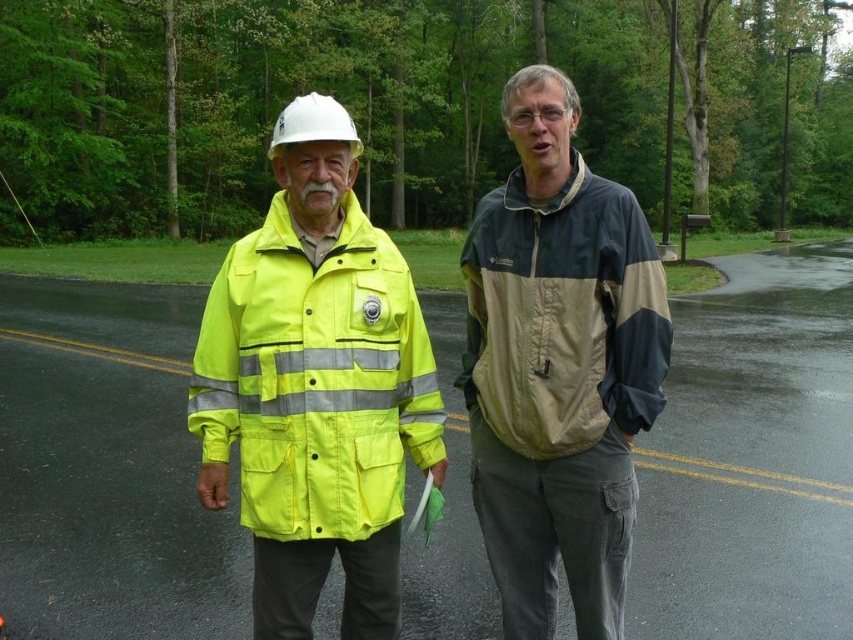
Question: Does high-visibility fabric jacket at left appear under white hard hat at center?

Choices:
 (A) yes
 (B) no

Answer: (A)

Question: Which of the following is the farthest from the observer?

Choices:
 (A) white hard hat at center
 (B) high-visibility yellow jacket at center
 (C) beige nylon jacket at center
 (D) high-visibility fabric jacket at left

Answer: (C)

Question: Which point is closer to the camera taking this photo?

Choices:
 (A) (521, 150)
 (B) (361, 236)
 (C) (660, 406)

Answer: (C)

Question: Among these objects, which one is farthest from the camera?

Choices:
 (A) high-visibility yellow jacket at center
 (B) high-visibility fabric jacket at left

Answer: (B)

Question: Where is high-visibility yellow jacket at center located in relation to beige nylon jacket at center in the image?

Choices:
 (A) left
 (B) right

Answer: (A)

Question: Is high-visibility fabric jacket at left in front of white hard hat at center?

Choices:
 (A) no
 (B) yes

Answer: (B)